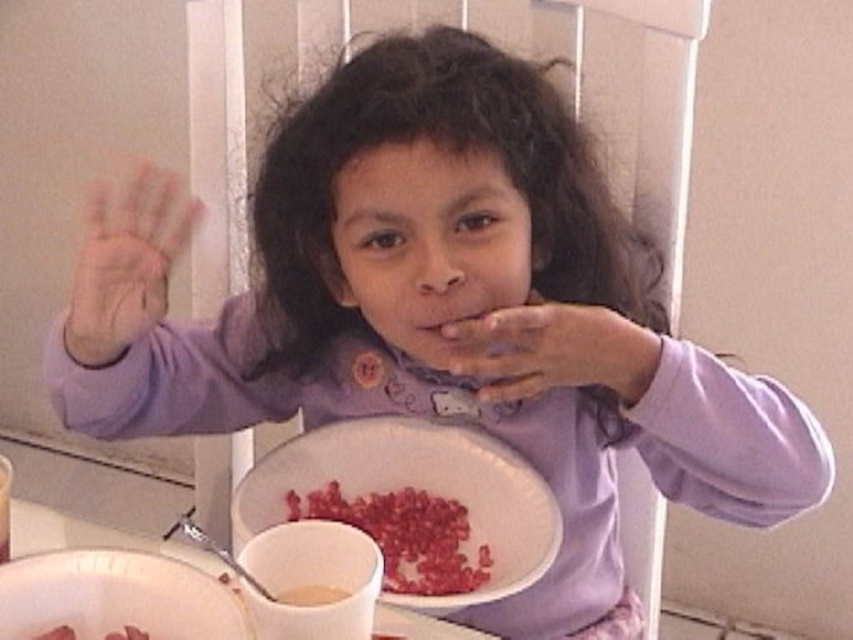
Question: Based on their relative distances, which object is farther from the white paper plate at lower center?

Choices:
 (A) matte skin hand at upper left
 (B) smooth red cereal at center

Answer: (A)

Question: Can you confirm if smooth skin hand at center is positioned above white matte spoon at lower center?

Choices:
 (A) yes
 (B) no

Answer: (A)

Question: Estimate the real-world distances between objects in this image. Which object is farther from the white glossy mug at lower center?

Choices:
 (A) matte skin hand at upper left
 (B) white paper plate at lower center
 (C) smooth skin hand at center
 (D) white matte spoon at lower center

Answer: (A)

Question: Which object appears closest to the camera in this image?

Choices:
 (A) white matte spoon at lower center
 (B) white glossy mug at lower center
 (C) white paper plate at lower center

Answer: (B)

Question: Does white paper plate at lower center appear on the right side of white glossy mug at lower center?

Choices:
 (A) yes
 (B) no

Answer: (A)

Question: Can you confirm if matte skin hand at upper left is wider than white glossy mug at lower center?

Choices:
 (A) yes
 (B) no

Answer: (B)